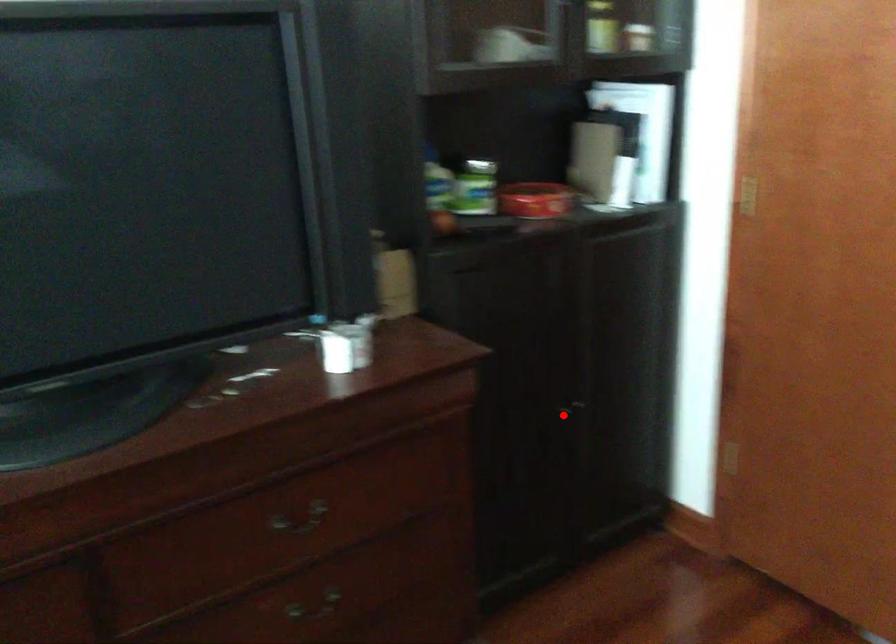
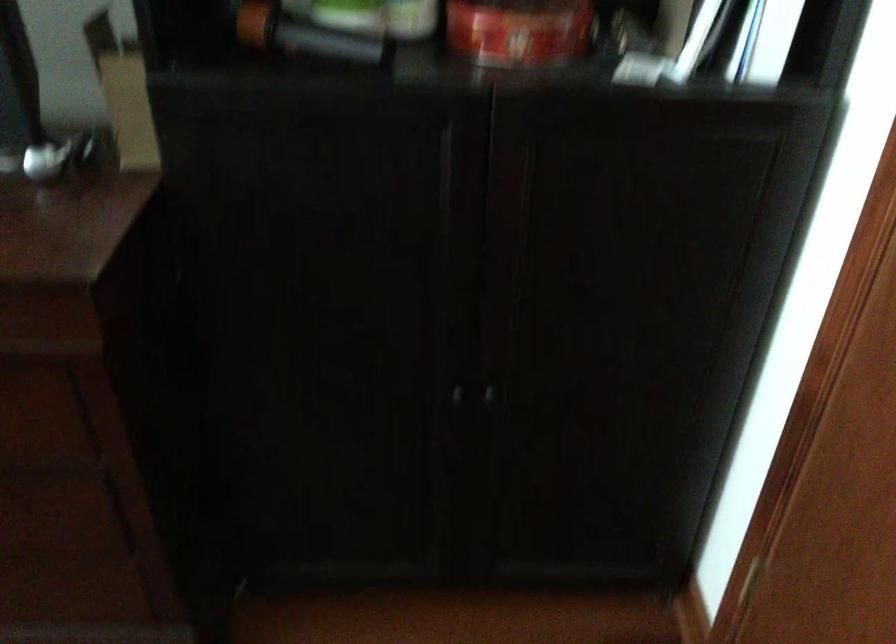
Question: I am providing you with two images of the same scene from different viewpoints. A red point is marked on the first image. At the location where the point appears in image 1, is it still visible in image 2?

Choices:
 (A) Yes
 (B) No

Answer: (A)